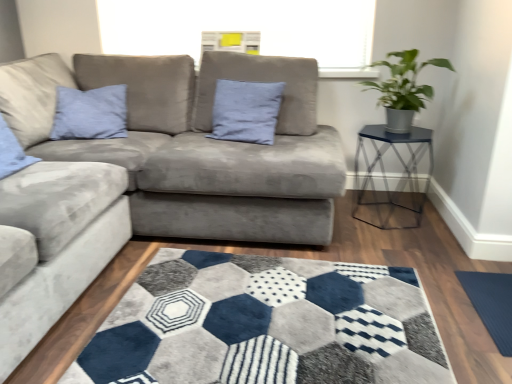
The height and width of the screenshot is (384, 512). What do you see at coordinates (213, 150) in the screenshot? I see `suede couch at center` at bounding box center [213, 150].

Describe the element at coordinates (490, 304) in the screenshot. Image resolution: width=512 pixels, height=384 pixels. I see `dark blue textured yoga mat at lower right` at that location.

Identify the location of dark blue textured yoga mat at lower right. (490, 304).

Describe the element at coordinates (383, 172) in the screenshot. I see `metal hexagonal table at right` at that location.

Identify the location of green matte plant at upper right. (403, 89).

Measure the distance from green matte plant at upper right to suede blue pillow at center.

green matte plant at upper right is 28.51 inches away from suede blue pillow at center.

Is green matte plant at upper right in contact with suede blue pillow at center?

There is a gap between green matte plant at upper right and suede blue pillow at center.

From the image's perspective, which one is positioned lower, green matte plant at upper right or suede blue pillow at center?

suede blue pillow at center appears lower in the image.

Is green matte plant at upper right inside the boundaries of suede couch at center, or outside?

The correct answer is: outside.

Based on the photo, is the position of green matte plant at upper right less distant than that of suede couch at center?

No, the depth of green matte plant at upper right is greater than that of suede couch at center.

Does green matte plant at upper right have a smaller size compared to suede couch at center?

Yes.

From a real-world perspective, who is located lower, green matte plant at upper right or suede couch at center?

suede couch at center is physically lower.

In terms of width, does suede blue pillow at center look wider or thinner when compared to dark blue textured yoga mat at lower right?

In the image, suede blue pillow at center appears to be more narrow than dark blue textured yoga mat at lower right.

From the picture: From a real-world perspective, is suede blue pillow at center positioned above or below dark blue textured yoga mat at lower right?

suede blue pillow at center is situated higher than dark blue textured yoga mat at lower right in the real world.

Can you confirm if suede blue pillow at center is taller than dark blue textured yoga mat at lower right?

Yes, suede blue pillow at center is taller than dark blue textured yoga mat at lower right.

From the image's perspective, is suede blue pillow at center below dark blue textured yoga mat at lower right?

No.

Is suede couch at center oriented towards metal hexagonal table at right?

Yes.

Looking at their sizes, would you say suede couch at center is wider or thinner than metal hexagonal table at right?

Considering their sizes, suede couch at center looks broader than metal hexagonal table at right.

Does point (186, 156) appear closer or farther from the camera than point (423, 136)?

Point (186, 156) is closer to the camera than point (423, 136).

Would you say suede couch at center contains metal hexagonal table at right?

That's incorrect, metal hexagonal table at right is not inside suede couch at center.

From the picture: Considering the relative positions of suede couch at center and suede blue pillow at center in the image provided, is suede couch at center to the left of suede blue pillow at center from the viewer's perspective?

Yes.

Is suede couch at center directly adjacent to suede blue pillow at center?

suede couch at center and suede blue pillow at center are not in contact.

From a real-world perspective, is suede couch at center positioned under suede blue pillow at center based on gravity?

Yes, from a real-world perspective, suede couch at center is below suede blue pillow at center.

Does metal hexagonal table at right appear on the left side of suede blue pillow at center?

Incorrect, metal hexagonal table at right is not on the left side of suede blue pillow at center.

Can you tell me how much metal hexagonal table at right and suede blue pillow at center differ in facing direction?

There is a 6.43-degree angle between the facing directions of metal hexagonal table at right and suede blue pillow at center.

Is metal hexagonal table at right located outside suede blue pillow at center?

Yes, metal hexagonal table at right is located beyond the bounds of suede blue pillow at center.

Considering the sizes of metal hexagonal table at right and suede blue pillow at center in the image, is metal hexagonal table at right bigger or smaller than suede blue pillow at center?

Considering their sizes, metal hexagonal table at right takes up more space than suede blue pillow at center.

Is metal hexagonal table at right wider or thinner than green matte plant at upper right?

Considering their sizes, metal hexagonal table at right looks broader than green matte plant at upper right.

Considering the relative sizes of metal hexagonal table at right and green matte plant at upper right in the image provided, is metal hexagonal table at right taller than green matte plant at upper right?

Indeed, metal hexagonal table at right has a greater height compared to green matte plant at upper right.

From a real-world perspective, is metal hexagonal table at right below green matte plant at upper right?

Indeed, from a real-world perspective, metal hexagonal table at right is positioned beneath green matte plant at upper right.

From the image's perspective, is metal hexagonal table at right positioned above or below green matte plant at upper right?

From the image's perspective, metal hexagonal table at right appears below green matte plant at upper right.

The height and width of the screenshot is (384, 512). I want to click on houseplant in front of the suede blue pillow at center, so click(x=403, y=89).

Where is `studio couch that is on the left side of green matte plant at upper right`? The image size is (512, 384). studio couch that is on the left side of green matte plant at upper right is located at coordinates (213, 150).

From the image, which object appears to be nearer to metal hexagonal table at right, suede couch at center or dark blue textured yoga mat at lower right?

Based on the image, dark blue textured yoga mat at lower right appears to be nearer to metal hexagonal table at right.

Considering their positions, is suede couch at center positioned closer to suede blue pillow at center than metal hexagonal table at right?

suede couch at center lies closer to suede blue pillow at center than the other object.

Considering their positions, is dark blue textured yoga mat at lower right positioned further to suede blue pillow at center than green matte plant at upper right?

dark blue textured yoga mat at lower right is positioned further to the anchor suede blue pillow at center.

Looking at the image, which one is located further to metal hexagonal table at right, dark blue textured yoga mat at lower right or suede blue pillow at center?

suede blue pillow at center.

Considering their positions, is dark blue textured yoga mat at lower right positioned further to suede blue pillow at center than metal hexagonal table at right?

Based on the image, dark blue textured yoga mat at lower right appears to be further to suede blue pillow at center.

Considering their positions, is suede blue pillow at center positioned closer to dark blue textured yoga mat at lower right than green matte plant at upper right?

Based on the image, green matte plant at upper right appears to be nearer to dark blue textured yoga mat at lower right.

When comparing their distances from suede couch at center, does metal hexagonal table at right or dark blue textured yoga mat at lower right seem further?

Based on the image, dark blue textured yoga mat at lower right appears to be further to suede couch at center.

From the image, which object appears to be nearer to dark blue textured yoga mat at lower right, suede couch at center or green matte plant at upper right?

Based on the image, green matte plant at upper right appears to be nearer to dark blue textured yoga mat at lower right.

Where is `yoga mat between suede couch at center and suede blue pillow at center in the front-back direction`? yoga mat between suede couch at center and suede blue pillow at center in the front-back direction is located at coordinates (490, 304).

Identify the location of yoga mat between suede couch at center and metal hexagonal table at right in the front-back direction. (490, 304).

The image size is (512, 384). What are the coordinates of `houseplant between suede couch at center and suede blue pillow at center from front to back` in the screenshot? It's located at (403, 89).

Where is `table located between suede blue pillow at center and dark blue textured yoga mat at lower right in the left-right direction`? This screenshot has height=384, width=512. table located between suede blue pillow at center and dark blue textured yoga mat at lower right in the left-right direction is located at coordinates (383, 172).